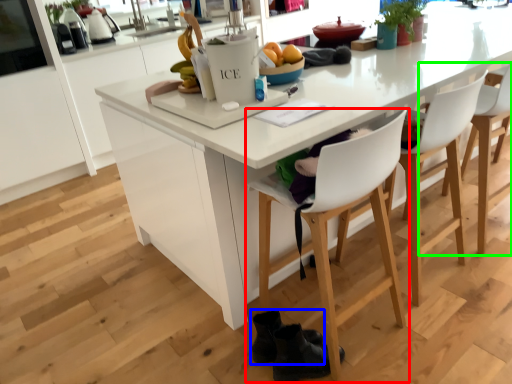
Question: Which object is positioned closest to chair (highlighted by a red box)? Select from footwear (highlighted by a blue box) and chair (highlighted by a green box).

Choices:
 (A) footwear
 (B) chair

Answer: (A)